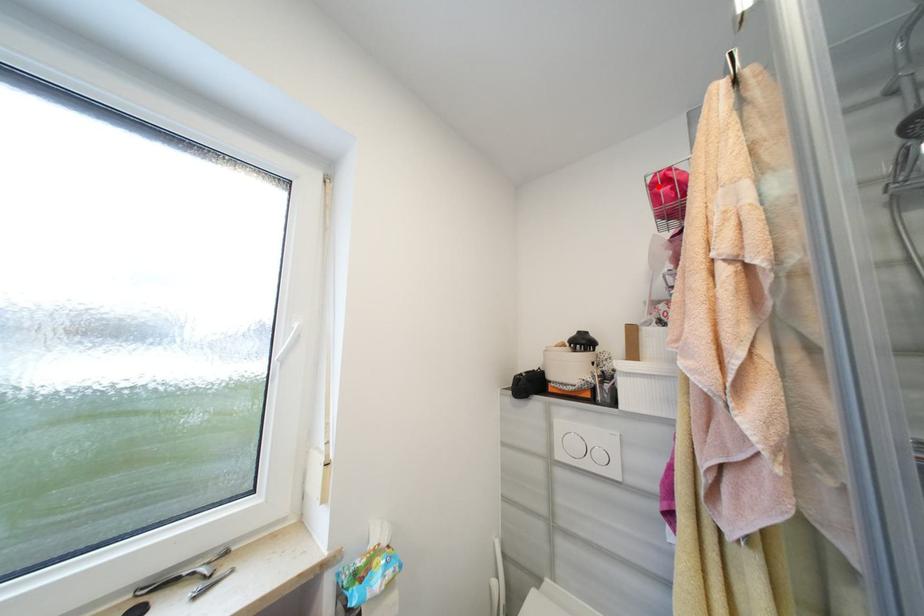
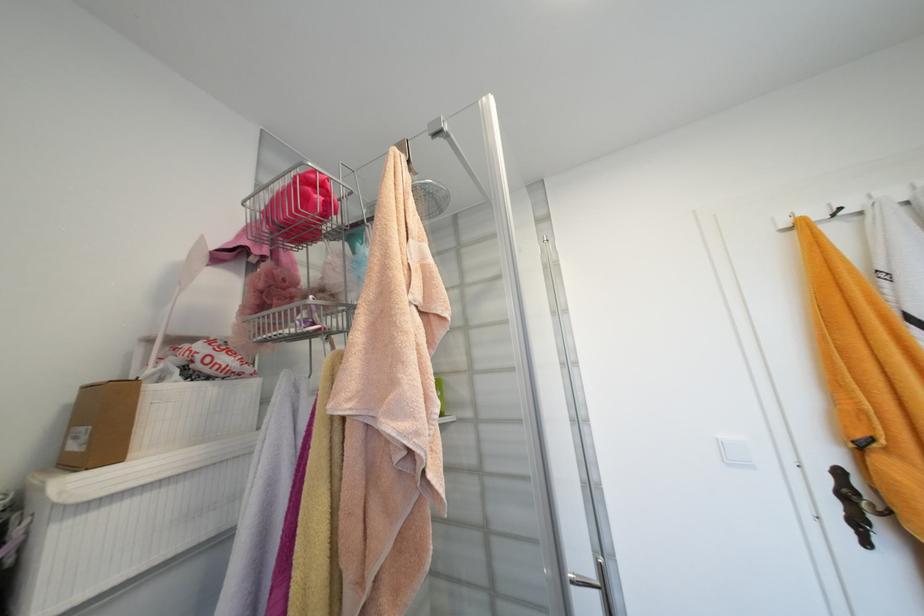
Where in the second image is the point corresponding to the highlighted location from the first image?

(312, 182)